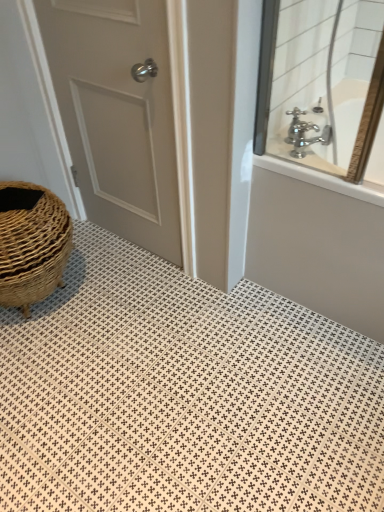
This screenshot has width=384, height=512. I want to click on free space in front of white matte door at left, so click(133, 302).